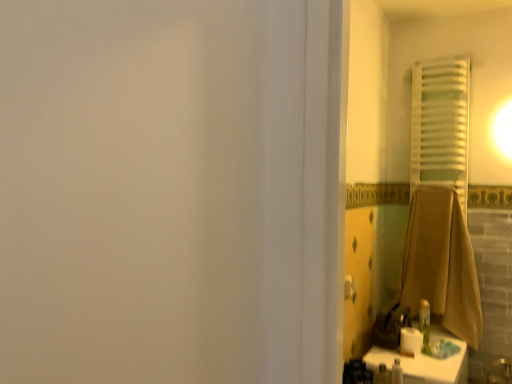
What do you see at coordinates (425, 362) in the screenshot?
I see `white glossy counter top at lower right` at bounding box center [425, 362].

Find the location of `white matte toilet paper at lower right`. white matte toilet paper at lower right is located at coordinates (410, 341).

The image size is (512, 384). What do you see at coordinates (440, 125) in the screenshot?
I see `white fabric towel at right` at bounding box center [440, 125].

This screenshot has height=384, width=512. Find the location of `brown cotton towel at right`. brown cotton towel at right is located at coordinates (441, 263).

From the image's perspective, which object appears higher, brown cotton towel at right or white matte toilet paper at lower right?

brown cotton towel at right is shown above in the image.

Is brown cotton towel at right with white matte toilet paper at lower right?

brown cotton towel at right is not next to white matte toilet paper at lower right, and they're not touching.

Considering the sizes of objects brown cotton towel at right and white matte toilet paper at lower right in the image provided, who is smaller, brown cotton towel at right or white matte toilet paper at lower right?

white matte toilet paper at lower right is smaller.

Could you tell me if brown cotton towel at right is turned towards white matte toilet paper at lower right?

Yes, brown cotton towel at right faces towards white matte toilet paper at lower right.

Could you measure the distance between white glossy counter top at lower right and white matte toilet paper at lower right?

white glossy counter top at lower right and white matte toilet paper at lower right are 4.50 inches apart from each other.

Which object is further away from the camera, white glossy counter top at lower right or white matte toilet paper at lower right?

white matte toilet paper at lower right is more distant.

In terms of height, does white glossy counter top at lower right look taller or shorter compared to white matte toilet paper at lower right?

white glossy counter top at lower right is taller than white matte toilet paper at lower right.

Is there a large distance between white matte toilet paper at lower right and white glossy counter top at lower right?

white matte toilet paper at lower right is near white glossy counter top at lower right, not far away.

Is white matte toilet paper at lower right wider than white glossy counter top at lower right?

No.

In the image, is white matte toilet paper at lower right positioned in front of or behind white glossy counter top at lower right?

white matte toilet paper at lower right is positioned farther from the viewer than white glossy counter top at lower right.

What's the angular difference between white matte toilet paper at lower right and white fabric towel at right's facing directions?

They differ by 84.4 degrees in their facing directions.

In the image, there is a white fabric towel at right. At what (x,y) coordinates should I click in order to perform the action: click on toilet paper below it (from a real-world perspective). Please return your answer as a coordinate pair (x, y). The height and width of the screenshot is (384, 512). Looking at the image, I should click on (410, 341).

In the scene shown: Is white matte toilet paper at lower right to the right of white fabric towel at right from the viewer's perspective?

No, white matte toilet paper at lower right is not to the right of white fabric towel at right.

Is white matte toilet paper at lower right wider or thinner than white fabric towel at right?

In the image, white matte toilet paper at lower right appears to be more narrow than white fabric towel at right.

Is brown cotton towel at right smaller than white glossy counter top at lower right?

Correct, brown cotton towel at right occupies less space than white glossy counter top at lower right.

Which object is closer to the camera taking this photo, brown cotton towel at right or white glossy counter top at lower right?

white glossy counter top at lower right is in front.

Considering the relative positions of brown cotton towel at right and white glossy counter top at lower right in the image provided, is brown cotton towel at right to the right of white glossy counter top at lower right from the viewer's perspective?

Yes.

Which object is wider, white glossy counter top at lower right or white fabric towel at right?

white glossy counter top at lower right is wider.

Identify the location of counter top below the white fabric towel at right (from the image's perspective). (425, 362).

Is white glossy counter top at lower right taller or shorter than white fabric towel at right?

Considering their sizes, white glossy counter top at lower right has less height than white fabric towel at right.

Is white matte toilet paper at lower right surrounded by white fabric towel at right?

That's incorrect, white matte toilet paper at lower right is not inside white fabric towel at right.

Would you consider white fabric towel at right to be distant from white matte toilet paper at lower right?

Yes.

From the image's perspective, between white fabric towel at right and white matte toilet paper at lower right, which one is located above?

From the image's view, white fabric towel at right is above.

Considering their positions, is white fabric towel at right located in front of or behind white matte toilet paper at lower right?

Clearly, white fabric towel at right is behind white matte toilet paper at lower right.

Locate an element on the screen. toilet paper located on the left of brown cotton towel at right is located at coordinates (410, 341).

Locate an element on the screen. counter top on the right of white matte toilet paper at lower right is located at coordinates (425, 362).

When comparing their distances from white fabric towel at right, does white glossy counter top at lower right or brown cotton towel at right seem further?

The object further to white fabric towel at right is white glossy counter top at lower right.

Considering their positions, is white matte toilet paper at lower right positioned further to brown cotton towel at right than white fabric towel at right?

Based on the image, white matte toilet paper at lower right appears to be further to brown cotton towel at right.

Looking at this image, estimate the real-world distances between objects in this image. Which object is further from white glossy counter top at lower right, white matte toilet paper at lower right or brown cotton towel at right?

The object further to white glossy counter top at lower right is brown cotton towel at right.

Which object lies further to the anchor point white glossy counter top at lower right, white fabric towel at right or white matte toilet paper at lower right?

Among the two, white fabric towel at right is located further to white glossy counter top at lower right.

Looking at the image, which one is located further to white matte toilet paper at lower right, brown cotton towel at right or white fabric towel at right?

Among the two, white fabric towel at right is located further to white matte toilet paper at lower right.

Looking at the image, which one is located closer to brown cotton towel at right, white fabric towel at right or white glossy counter top at lower right?

white glossy counter top at lower right lies closer to brown cotton towel at right than the other object.

Based on their spatial positions, is white glossy counter top at lower right or white fabric towel at right further from white matte toilet paper at lower right?

Among the two, white fabric towel at right is located further to white matte toilet paper at lower right.

Considering their positions, is brown cotton towel at right positioned further to white fabric towel at right than white matte toilet paper at lower right?

white matte toilet paper at lower right is further to white fabric towel at right.

Where is `bath towel between white fabric towel at right and white matte toilet paper at lower right in the vertical direction`? The image size is (512, 384). bath towel between white fabric towel at right and white matte toilet paper at lower right in the vertical direction is located at coordinates (441, 263).

Where is `toilet paper between brown cotton towel at right and white glossy counter top at lower right from top to bottom`? The height and width of the screenshot is (384, 512). toilet paper between brown cotton towel at right and white glossy counter top at lower right from top to bottom is located at coordinates (410, 341).

The height and width of the screenshot is (384, 512). Identify the location of toilet paper that lies between white fabric towel at right and white glossy counter top at lower right from top to bottom. (410, 341).

Locate an element on the screen. This screenshot has height=384, width=512. bath towel between white fabric towel at right and white glossy counter top at lower right in the up-down direction is located at coordinates (441, 263).